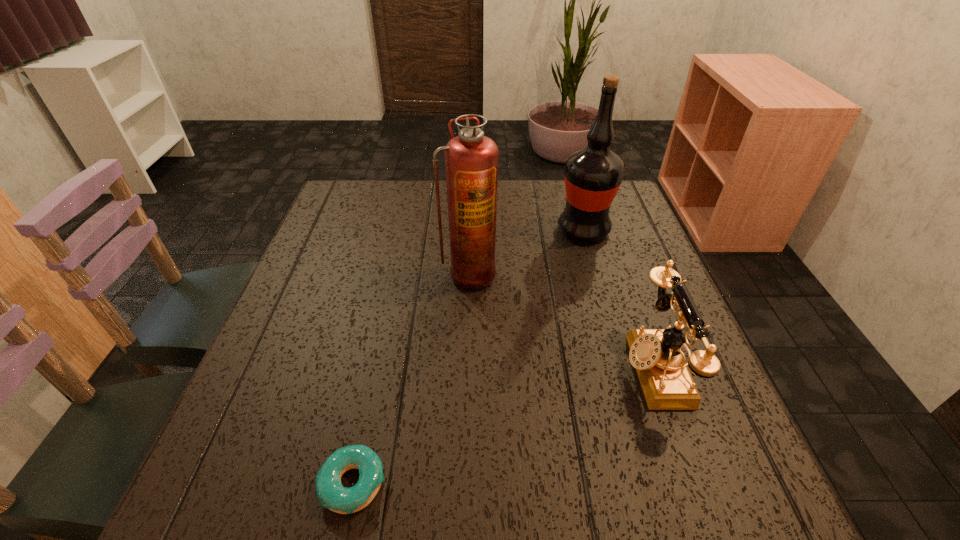
The width and height of the screenshot is (960, 540). I want to click on blank area located on the dial of the third tallest object, so tap(519, 368).

Where is `vacant space located on the dial of the third tallest object`? vacant space located on the dial of the third tallest object is located at coordinates (540, 368).

Find the location of a particular element. The width and height of the screenshot is (960, 540). free space located on the back of the leftmost object is located at coordinates (368, 415).

Locate an element on the screen. object situated at the far edge is located at coordinates (593, 175).

This screenshot has height=540, width=960. What are the coordinates of `object at the near edge` in the screenshot? It's located at (332, 495).

Locate an element on the screen. The image size is (960, 540). wine bottle present at the right edge is located at coordinates (593, 175).

Where is `telephone at the right edge`? The width and height of the screenshot is (960, 540). telephone at the right edge is located at coordinates (667, 384).

You are a GUI agent. You are given a task and a screenshot of the screen. Output one action in this format:
    pyautogui.click(x=<x>, y=<y>)
    Task: Click on the object that is at the far right corner
    This screenshot has width=960, height=540.
    Given the screenshot: What is the action you would take?
    pyautogui.click(x=593, y=175)

Identify the location of vacant space at the far edge of the desktop. (544, 183).

In the image, there is a desktop. Where is `vacant space at the near edge`? The image size is (960, 540). vacant space at the near edge is located at coordinates (547, 509).